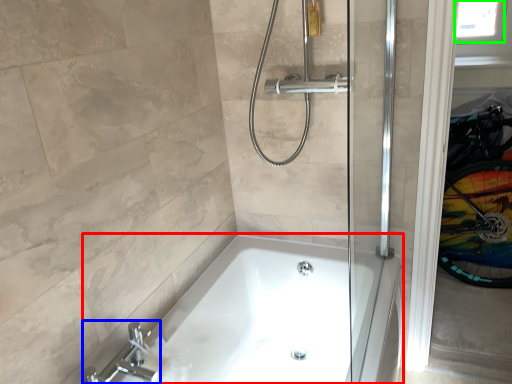
Question: Which is farther away from bathtub (highlighted by a red box)? tap (highlighted by a blue box) or window screen (highlighted by a green box)?

Choices:
 (A) tap
 (B) window screen

Answer: (B)